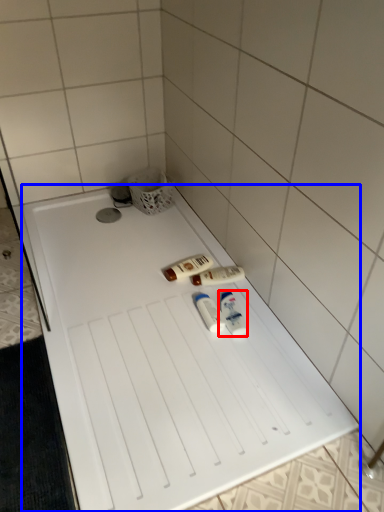
Question: Which object appears farthest to the camera in this image, toiletry (highlighted by a red box) or furniture (highlighted by a blue box)?

Choices:
 (A) toiletry
 (B) furniture

Answer: (A)